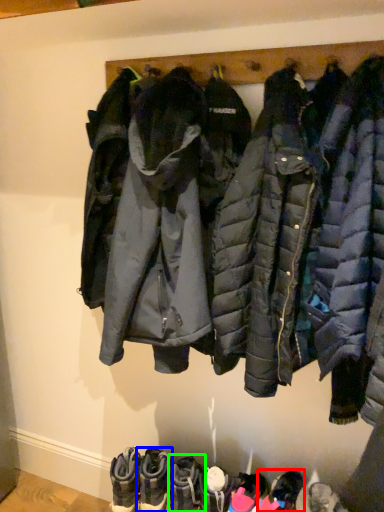
Question: Which object is the closest to the footwear (highlighted by a red box)? Choose among these: footwear (highlighted by a blue box) or footwear (highlighted by a green box).

Choices:
 (A) footwear
 (B) footwear

Answer: (B)